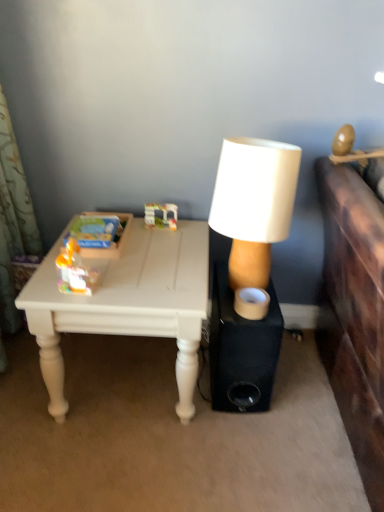
Find the location of a particular element. vacant point to the right of black matte speaker at center is located at coordinates (300, 385).